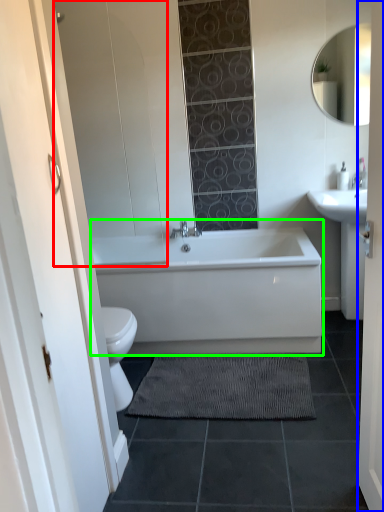
Question: Considering the real-world distances, which object is closest to glass door (highlighted by a red box)? door (highlighted by a blue box) or bathtub (highlighted by a green box).

Choices:
 (A) door
 (B) bathtub

Answer: (B)